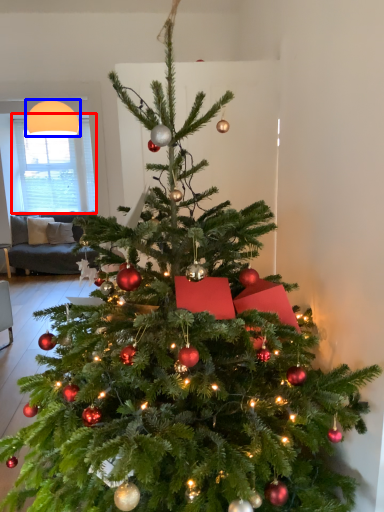
Question: Which object appears farthest to the camera in this image, window screen (highlighted by a red box) or lamp (highlighted by a blue box)?

Choices:
 (A) window screen
 (B) lamp

Answer: (A)